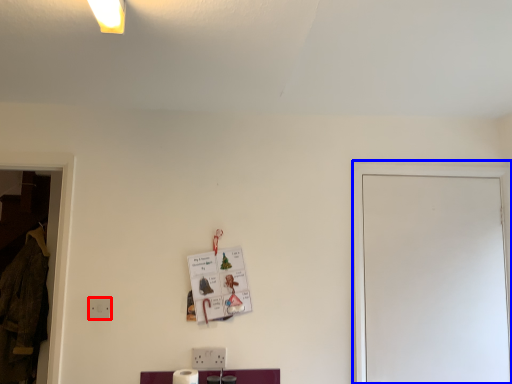
Question: Which of the following is the farthest to the observer, electric outlet (highlighted by a red box) or glass door (highlighted by a blue box)?

Choices:
 (A) electric outlet
 (B) glass door

Answer: (B)